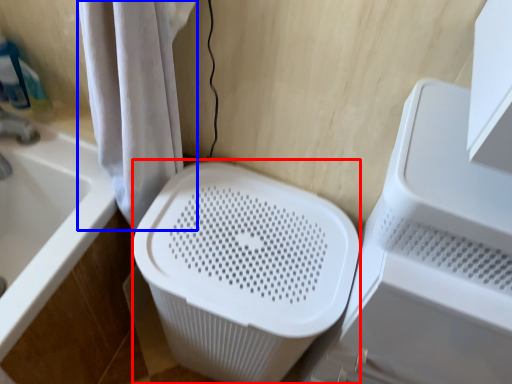
Question: Which object appears farthest to the camera in this image, laundry basket (highlighted by a red box) or shower curtain (highlighted by a blue box)?

Choices:
 (A) laundry basket
 (B) shower curtain

Answer: (A)